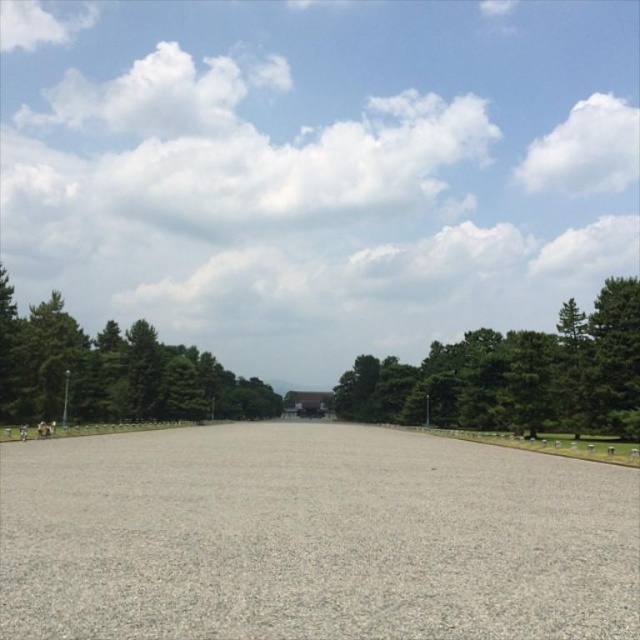
Can you confirm if green leafy tree at center is positioned above green leafy tree at upper center?

Yes, green leafy tree at center is above green leafy tree at upper center.

In order to click on green leafy tree at center in this screenshot , I will do `click(515, 376)`.

Between point (396, 416) and point (120, 406), which one is positioned behind?

The point (396, 416) is behind.

You are a GUI agent. You are given a task and a screenshot of the screen. Output one action in this format:
    pyautogui.click(x=<x>, y=<y>)
    Task: Click on the green leafy tree at center
    Image resolution: width=640 pixels, height=640 pixels.
    Given the screenshot: What is the action you would take?
    pyautogui.click(x=515, y=376)

Which is above, gray gravel at center or green leafy tree at upper center?

gray gravel at center

Is gray gravel at center below green leafy tree at upper center?

Actually, gray gravel at center is above green leafy tree at upper center.

Does point (376, 572) lie behind point (262, 403)?

No, (376, 572) is in front of (262, 403).

Locate an element on the screen. This screenshot has width=640, height=640. gray gravel at center is located at coordinates (312, 538).

Describe the element at coordinates (312, 538) in the screenshot. The image size is (640, 640). I see `gray gravel at center` at that location.

Which is more to the right, gray gravel at center or green leafy tree at center?

A: green leafy tree at center is more to the right.

Is point (108, 548) less distant than point (630, 353)?

Yes, point (108, 548) is closer to viewer.

Locate an element on the screen. gray gravel at center is located at coordinates 312,538.